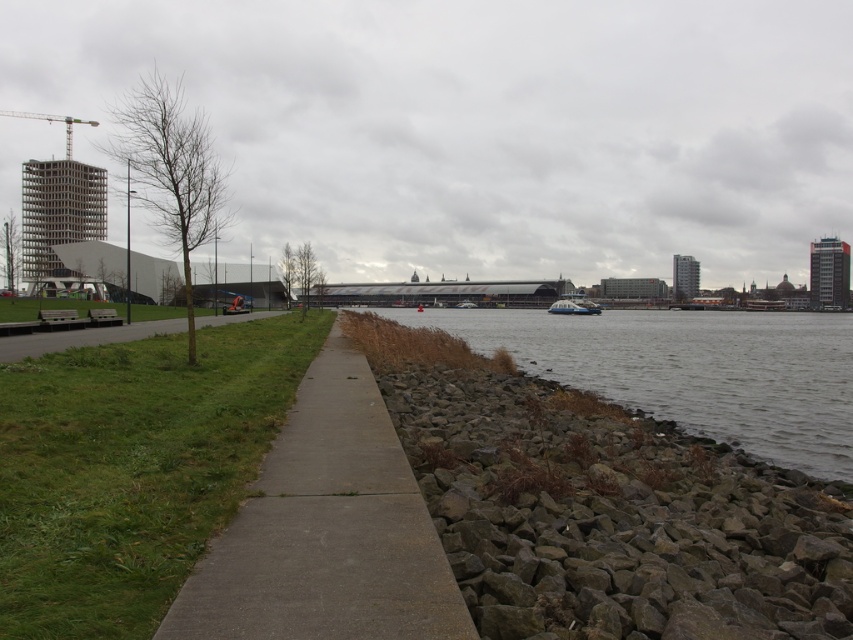
Between concrete sidewalk at center and gray stone river at center, which one has less height?

Standing shorter between the two is concrete sidewalk at center.

I want to click on concrete sidewalk at center, so click(x=326, y=531).